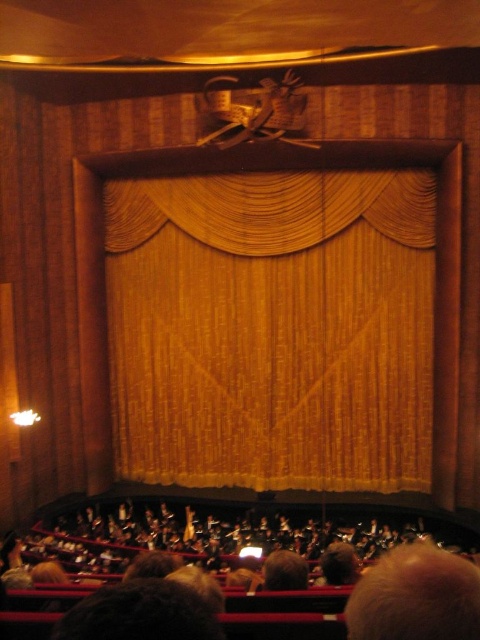
Which is more to the left, gold textured curtain at center or dark brown hair at lower center?

Positioned to the left is dark brown hair at lower center.

In order to click on gold textured curtain at center in this screenshot , I will do `click(273, 328)`.

In order to click on gold textured curtain at center in this screenshot , I will do `click(273, 328)`.